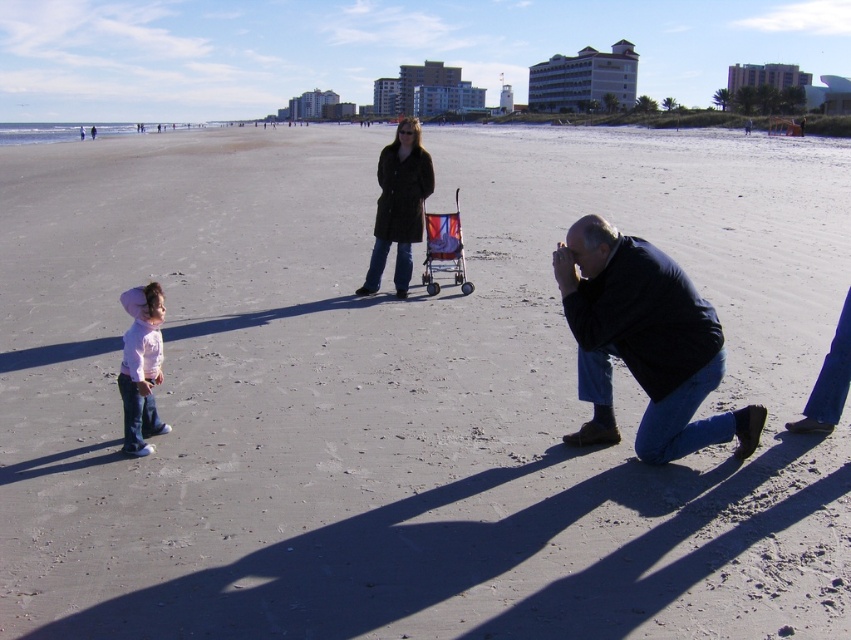
Between dark brown coat at center and pink matte shirt at lower left, which one appears on the right side from the viewer's perspective?

From the viewer's perspective, dark brown coat at center appears more on the right side.

The height and width of the screenshot is (640, 851). Describe the element at coordinates (398, 205) in the screenshot. I see `dark brown coat at center` at that location.

The width and height of the screenshot is (851, 640). In order to click on dark brown coat at center in this screenshot , I will do `click(398, 205)`.

Between dark blue jacket at lower right and dark brown coat at center, which one has less height?

dark blue jacket at lower right is shorter.

Is dark blue jacket at lower right further to the viewer compared to dark brown coat at center?

No.

Between point (620, 337) and point (413, 204), which one is positioned in front?

Point (620, 337)

You are a GUI agent. You are given a task and a screenshot of the screen. Output one action in this format:
    pyautogui.click(x=<x>, y=<y>)
    Task: Click on the dark blue jacket at lower right
    This screenshot has height=640, width=851.
    Given the screenshot: What is the action you would take?
    pyautogui.click(x=644, y=342)

Between dark blue jacket at lower right and pink matte shirt at lower left, which one is positioned higher?

dark blue jacket at lower right is higher up.

Does dark blue jacket at lower right have a greater width compared to pink matte shirt at lower left?

Correct, the width of dark blue jacket at lower right exceeds that of pink matte shirt at lower left.

The width and height of the screenshot is (851, 640). What do you see at coordinates (644, 342) in the screenshot?
I see `dark blue jacket at lower right` at bounding box center [644, 342].

This screenshot has height=640, width=851. Identify the location of dark blue jacket at lower right. pyautogui.click(x=644, y=342).